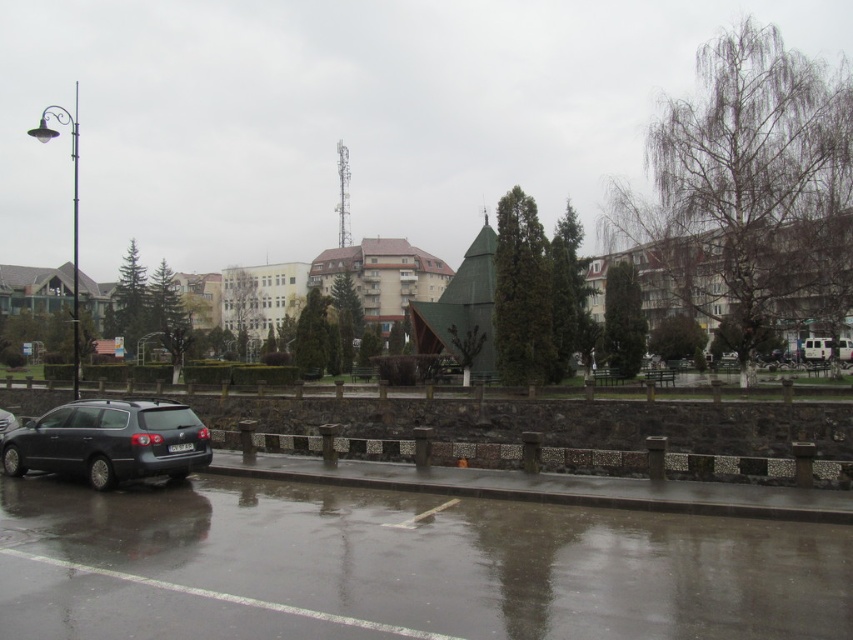
Question: Is satin black station wagon at lower left positioned behind satin black sedan at left?

Choices:
 (A) yes
 (B) no

Answer: (B)

Question: Which point appears closest to the camera in this image?

Choices:
 (A) (840, 356)
 (B) (22, 472)
 (C) (4, 429)

Answer: (B)

Question: Can you confirm if metallic silver suv at lower right is smaller than satin black sedan at left?

Choices:
 (A) no
 (B) yes

Answer: (B)

Question: Which object is farther from the camera taking this photo?

Choices:
 (A) metallic silver suv at lower right
 (B) satin black sedan at left
 (C) satin black station wagon at lower left

Answer: (A)

Question: Is the position of satin black station wagon at lower left less distant than that of metallic silver suv at lower right?

Choices:
 (A) no
 (B) yes

Answer: (B)

Question: Which object is positioned closest to the satin black sedan at left?

Choices:
 (A) satin black station wagon at lower left
 (B) metallic silver suv at lower right

Answer: (A)